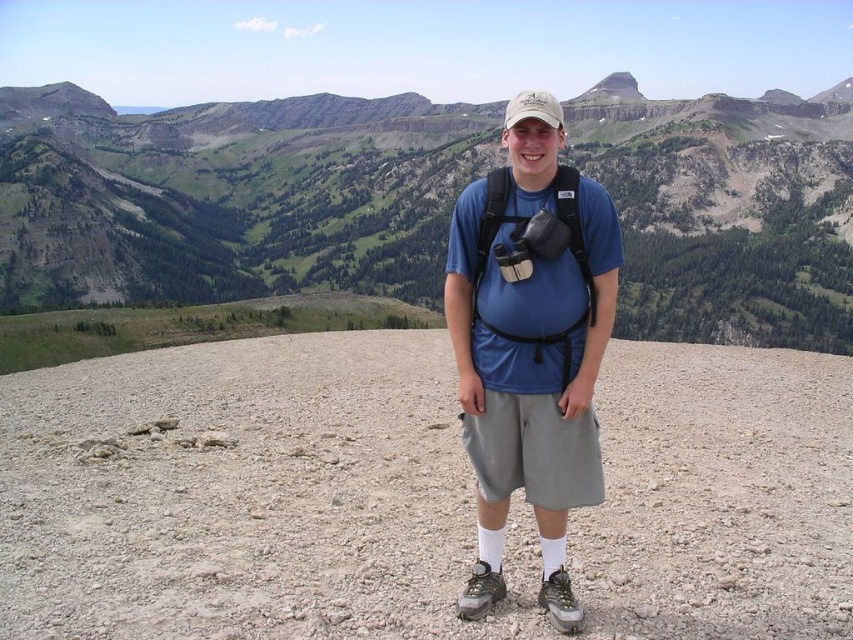
Question: Is gray gravel at center thinner than blue fabric backpack at center?

Choices:
 (A) no
 (B) yes

Answer: (A)

Question: Which point is farther from the camera taking this photo?

Choices:
 (A) (821, 140)
 (B) (558, 490)
 (C) (54, 536)

Answer: (A)

Question: Is green grassy mountain at center to the left of blue fabric backpack at center from the viewer's perspective?

Choices:
 (A) no
 (B) yes

Answer: (B)

Question: Which point appears closest to the camera in this image?

Choices:
 (A) (0, 465)
 (B) (560, 436)
 (C) (177, 268)

Answer: (B)

Question: From the image, what is the correct spatial relationship of gray gravel at center in relation to blue fabric backpack at center?

Choices:
 (A) below
 (B) above

Answer: (A)

Question: Which point is closer to the camera?

Choices:
 (A) green grassy mountain at center
 (B) gray gravel at center

Answer: (B)